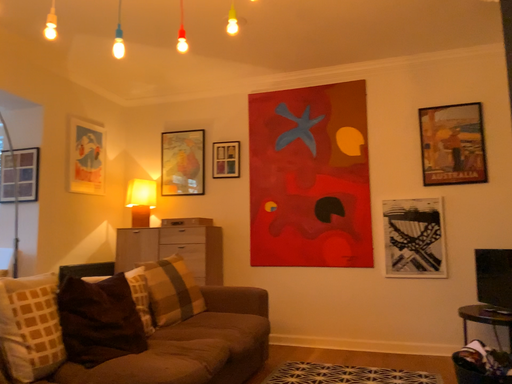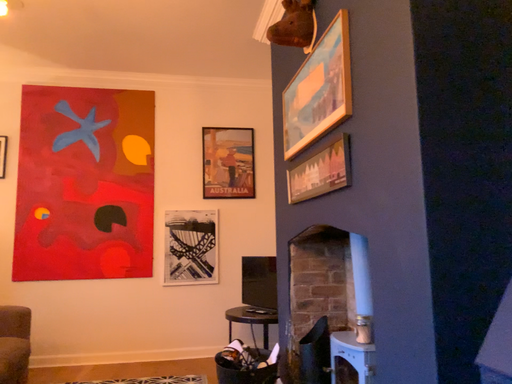
Question: How did the camera likely rotate when shooting the video?

Choices:
 (A) rotated right
 (B) rotated left

Answer: (A)